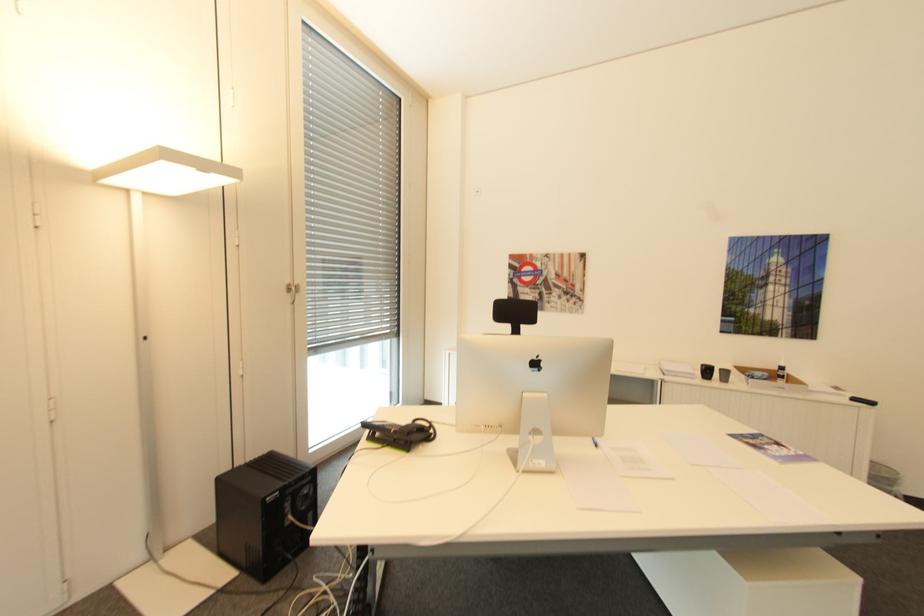
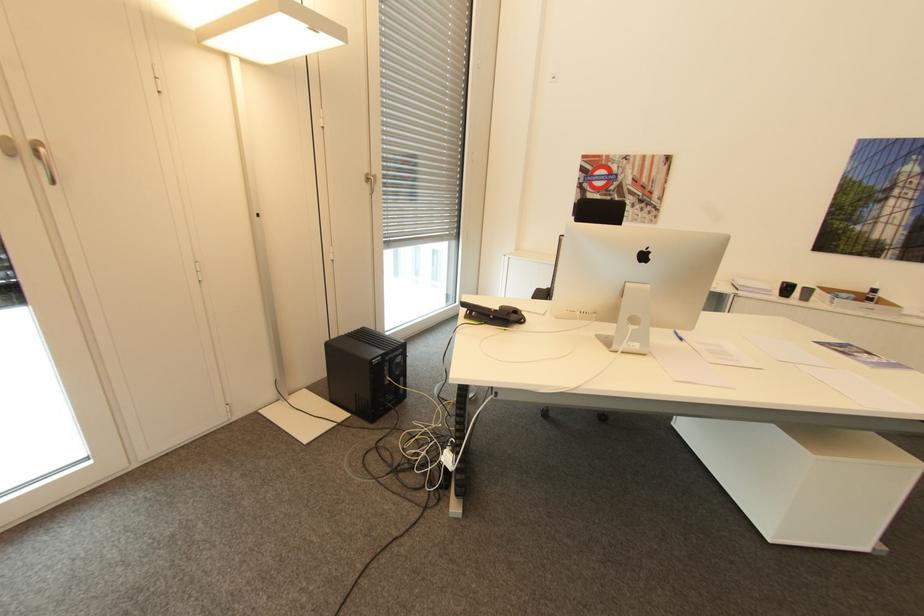
Where in the second image is the point corresponding to the point at 296,517 from the first image?

(394, 379)